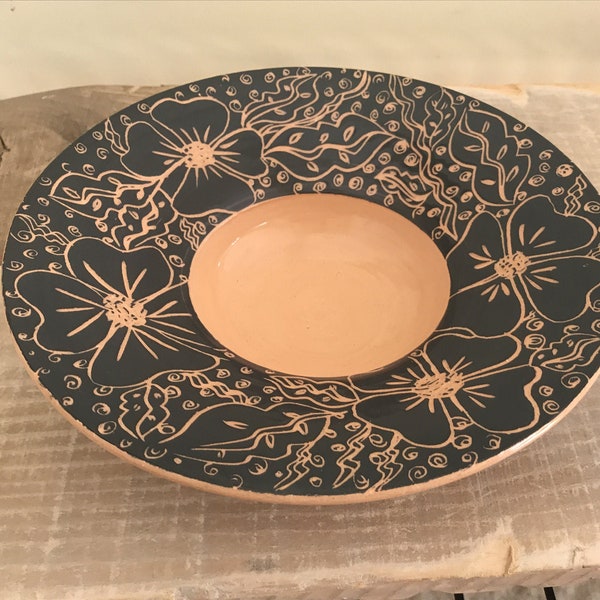
The height and width of the screenshot is (600, 600). What are the coordinates of `stone table or bench` in the screenshot? It's located at (119, 518).